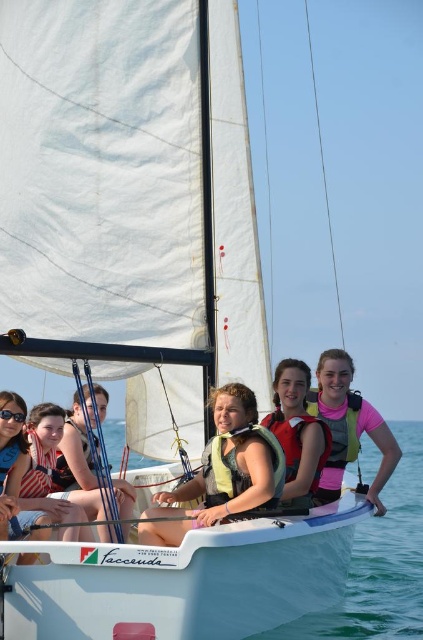
Question: From the image, what is the correct spatial relationship of yellow life vest at center in relation to matte black life vest at center?

Choices:
 (A) left
 (B) right

Answer: (B)

Question: Among these objects, which one is farthest from the camera?

Choices:
 (A) pink life vest at center
 (B) pink fabric life jacket at center
 (C) light yellow life jacket at center

Answer: (B)

Question: Where is clear blue water at center located in relation to yellow life vest at center in the image?

Choices:
 (A) right
 (B) left

Answer: (B)

Question: Which of the following is the closest to the observer?

Choices:
 (A) (332, 422)
 (B) (285, 442)

Answer: (B)

Question: Is matte yellow life jacket at center thinner than pink fabric life jacket at center?

Choices:
 (A) no
 (B) yes

Answer: (A)

Question: Which object is closer to the camera taking this photo?

Choices:
 (A) yellow life vest at center
 (B) matte black life vest at center
 (C) pink life vest at center
 (D) pink fabric life jacket at center

Answer: (A)